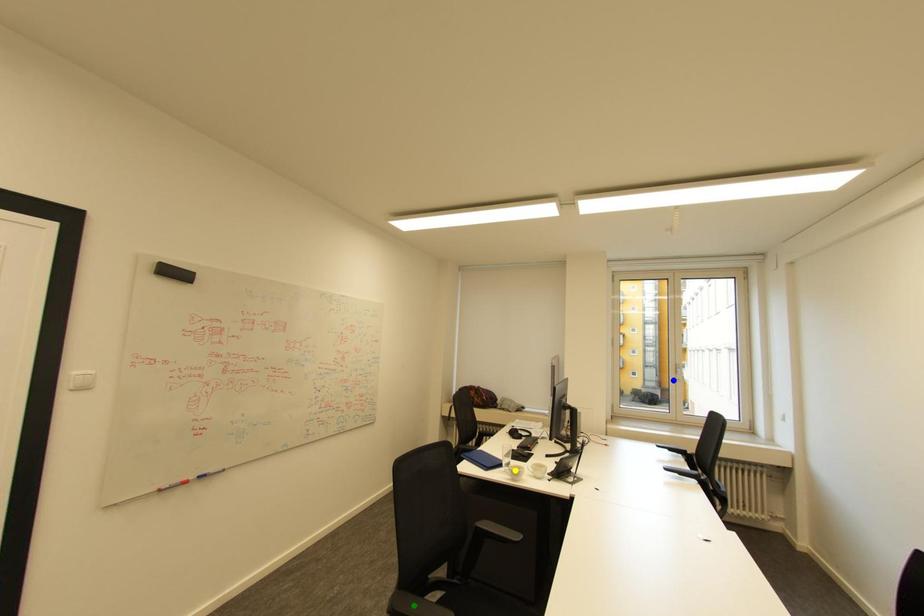
Order these from nearest to farthest:
1. yellow point
2. blue point
3. green point

green point → yellow point → blue point